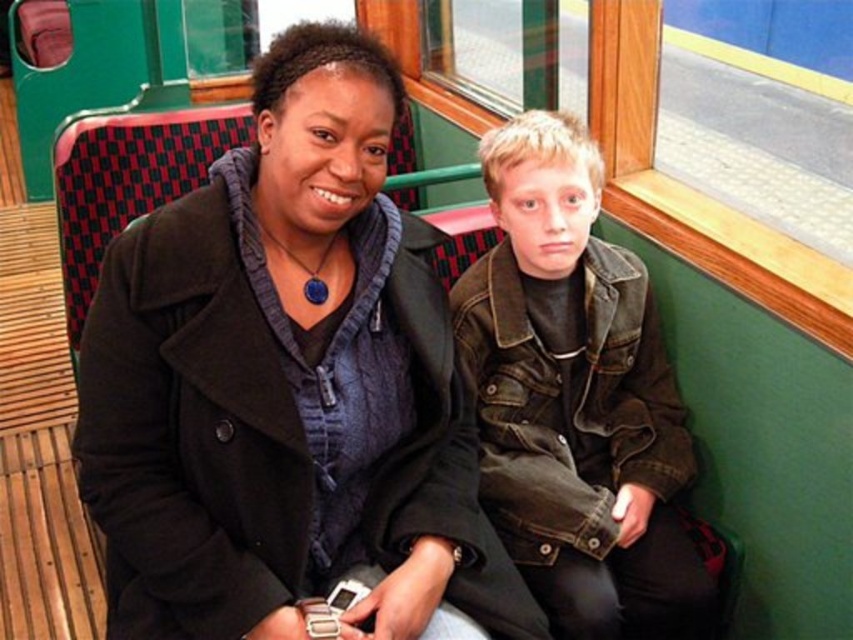
Which is below, black woolen coat at center or denim jacket at center?

denim jacket at center is below.

Is black woolen coat at center further to the viewer compared to denim jacket at center?

No, it is not.

Does point (141, 403) come behind point (577, 560)?

No, (141, 403) is in front of (577, 560).

Where is `black woolen coat at center`? This screenshot has height=640, width=853. black woolen coat at center is located at coordinates (286, 385).